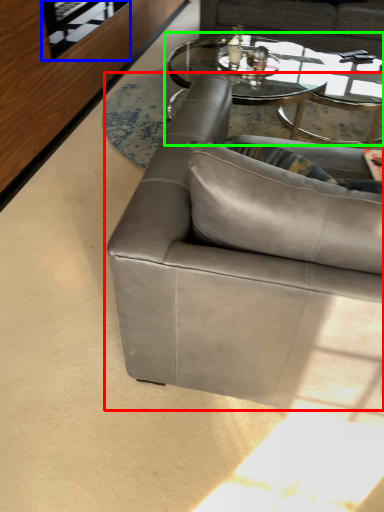
Question: Based on their relative distances, which object is farther from studio couch (highlighted by a red box)? Choose from glass door (highlighted by a blue box) and coffee table (highlighted by a green box).

Choices:
 (A) glass door
 (B) coffee table

Answer: (B)